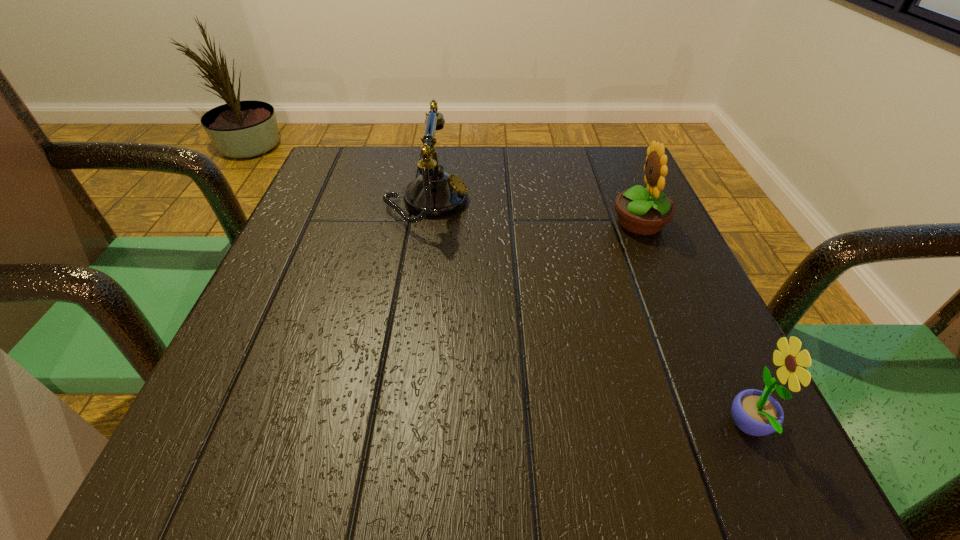
The height and width of the screenshot is (540, 960). What are the coordinates of `object that is at the far edge` in the screenshot? It's located at tap(434, 193).

I want to click on object at the near edge, so click(x=757, y=413).

In order to click on object that is at the near right corner in this screenshot , I will do `click(757, 413)`.

Where is `free space at the far edge of the desktop`? free space at the far edge of the desktop is located at coordinates (511, 166).

The image size is (960, 540). What are the coordinates of `vacant space at the near edge` in the screenshot? It's located at (638, 471).

The width and height of the screenshot is (960, 540). I want to click on free location at the left edge of the desktop, so click(x=204, y=418).

Locate an element on the screen. The width and height of the screenshot is (960, 540). vacant space at the right edge is located at coordinates (593, 240).

This screenshot has height=540, width=960. Identify the location of free space at the far left corner of the desktop. (321, 199).

The width and height of the screenshot is (960, 540). Find the location of `vacant region at the near left corner`. vacant region at the near left corner is located at coordinates (306, 468).

Locate an element on the screen. This screenshot has height=540, width=960. free space at the far right corner of the desktop is located at coordinates (623, 154).